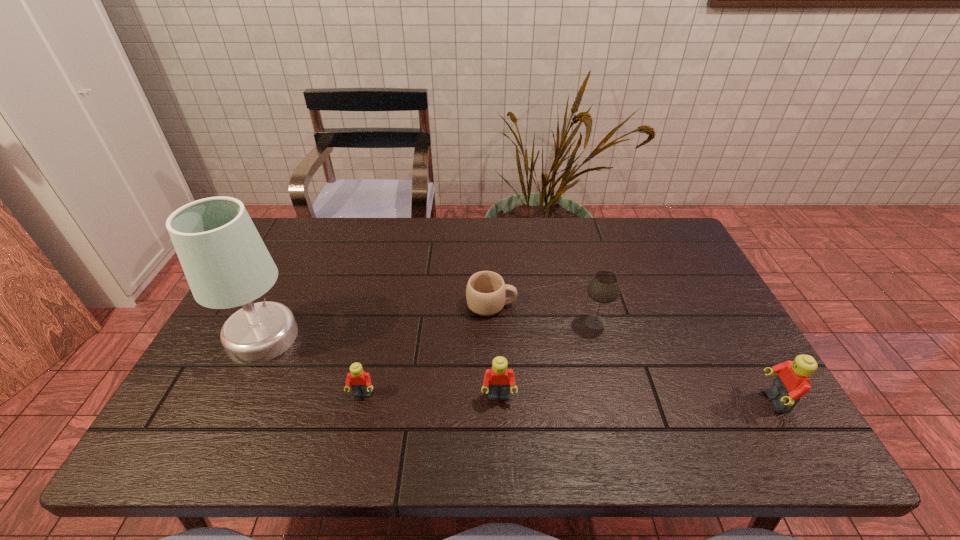
To make them evenly spaced by inserting another Lego among them, please locate a vacant spot for this new Lego. Please provide its 2D coordinates. Your answer should be formatted as a tuple, i.e. [(x, y)], where the tuple contains the x and y coordinates of a point satisfying the conditions above.

[(636, 399)]